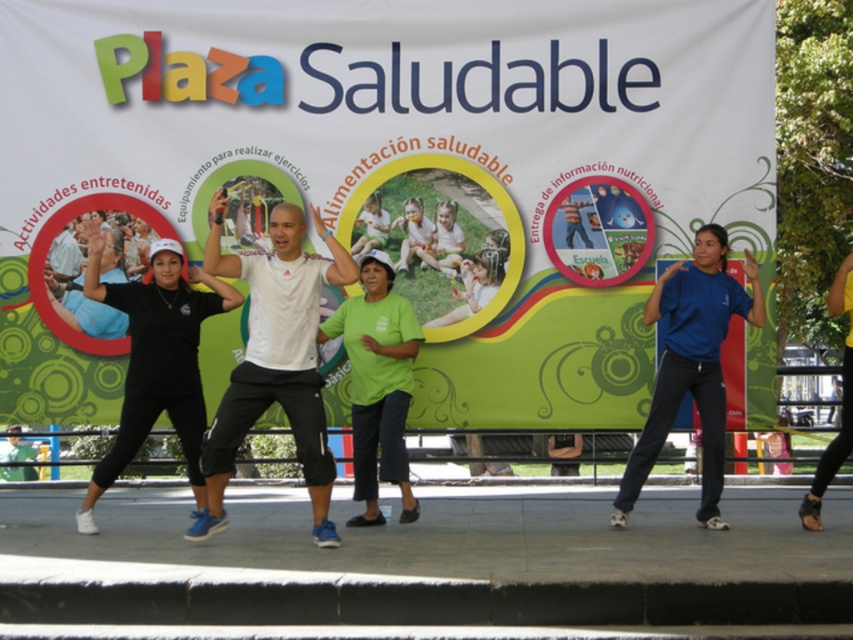
Question: Which point appears farthest from the camera in this image?

Choices:
 (A) (837, 288)
 (B) (253, 301)
 (C) (709, 301)

Answer: (C)

Question: Can you confirm if white paper banner at upper center is bigger than yellow fabric skirt at lower right?

Choices:
 (A) no
 (B) yes

Answer: (A)

Question: Can you confirm if white paper banner at upper center is positioned to the right of white matte t-shirt at center?

Choices:
 (A) no
 (B) yes

Answer: (A)

Question: Estimate the real-world distances between objects in this image. Which object is farther from the green matte shirt at center?

Choices:
 (A) yellow fabric skirt at lower right
 (B) blue matte shirt at center
 (C) black matte shirt at center

Answer: (A)

Question: Which object appears closest to the camera in this image?

Choices:
 (A) white paper banner at upper center
 (B) white matte t-shirt at center
 (C) black matte shirt at center
 (D) blue matte shirt at center

Answer: (B)

Question: Considering the relative positions of white matte t-shirt at center and blue matte shirt at center in the image provided, where is white matte t-shirt at center located with respect to blue matte shirt at center?

Choices:
 (A) above
 (B) below

Answer: (A)